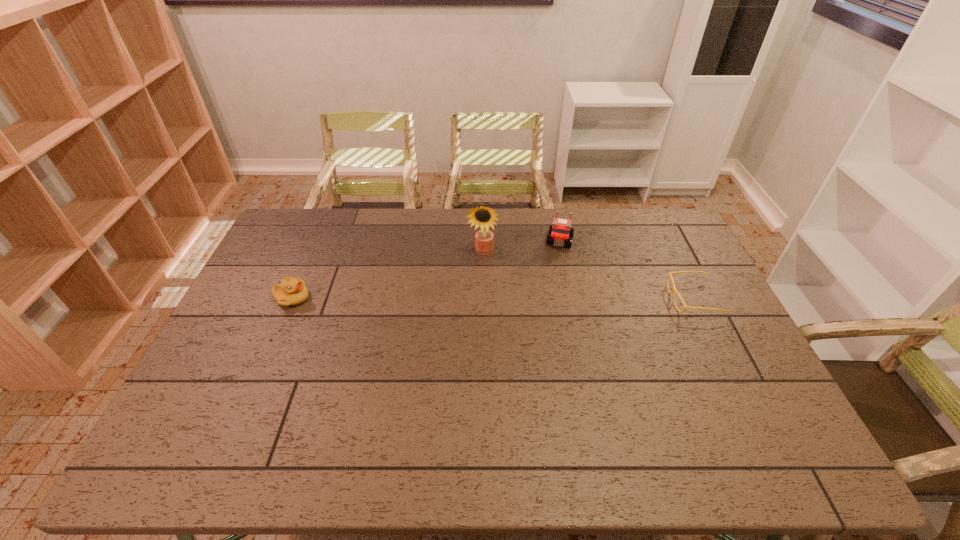
This screenshot has width=960, height=540. I want to click on free space that satisfies the following two spatial constraints: 1. on the front side of the rightmost object; 2. in front of the lenses of the tallest object, so click(482, 299).

Locate an element on the screen. This screenshot has height=540, width=960. vacant region that satisfies the following two spatial constraints: 1. on the front side of the shortest object; 2. in front of the lenses of the sunflower is located at coordinates (482, 299).

Locate an element on the screen. This screenshot has height=540, width=960. vacant space that satisfies the following two spatial constraints: 1. on the front side of the third object from right to left; 2. in front of the lenses of the spectacles is located at coordinates (482, 299).